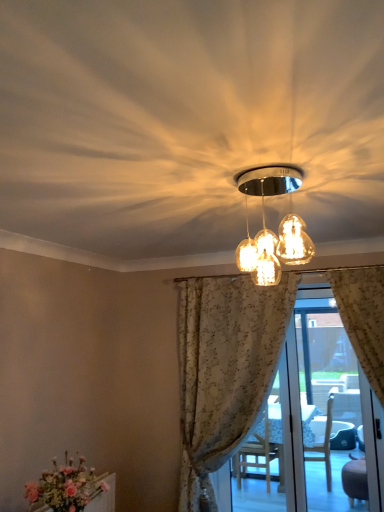
The image size is (384, 512). In order to click on floral fabric curtain at center in this screenshot , I will do `click(225, 369)`.

Find the location of `matte pink flowers at lower left`. matte pink flowers at lower left is located at coordinates (65, 487).

Is matte glass light fixture at center at the back of matte pink flowers at lower left?

No, matte pink flowers at lower left's orientation is not away from matte glass light fixture at center.

Who is bigger, matte pink flowers at lower left or matte glass light fixture at center?

Bigger between the two is matte pink flowers at lower left.

Considering the positions of point (85, 497) and point (270, 170), is point (85, 497) closer or farther from the camera than point (270, 170)?

Point (85, 497).

Which of these two, matte pink flowers at lower left or matte glass light fixture at center, is thinner?

matte pink flowers at lower left is thinner.

From a real-world perspective, does translucent floral curtains at center sit lower than matte glass light fixture at center?

Yes, from a real-world perspective, translucent floral curtains at center is below matte glass light fixture at center.

Identify the location of lamp above the translucent floral curtains at center (from the image's perspective). The height and width of the screenshot is (512, 384). (284, 251).

Does translucent floral curtains at center appear on the left side of matte glass light fixture at center?

In fact, translucent floral curtains at center is to the right of matte glass light fixture at center.

Is translucent floral curtains at center placed right next to matte glass light fixture at center?

No, translucent floral curtains at center is not in contact with matte glass light fixture at center.

From a real-world perspective, is matte glass light fixture at center physically located above or below matte pink flowers at lower left?

From a real-world perspective, matte glass light fixture at center is physically above matte pink flowers at lower left.

Is matte glass light fixture at center behind matte pink flowers at lower left?

No, matte glass light fixture at center is closer to the camera.

In the scene shown: Considering the sizes of matte glass light fixture at center and matte pink flowers at lower left in the image, is matte glass light fixture at center bigger or smaller than matte pink flowers at lower left?

Considering their sizes, matte glass light fixture at center takes up less space than matte pink flowers at lower left.

Is matte pink flowers at lower left surrounding floral fabric curtain at center?

No, floral fabric curtain at center is not a part of matte pink flowers at lower left.

Which of these two, matte pink flowers at lower left or floral fabric curtain at center, is wider?

floral fabric curtain at center is wider.

Could you tell me if matte glass light fixture at center is turned towards translucent floral curtains at center?

No, matte glass light fixture at center does not turn towards translucent floral curtains at center.

Does matte glass light fixture at center have a lesser width compared to translucent floral curtains at center?

No.

From a real-world perspective, is matte glass light fixture at center physically located above or below translucent floral curtains at center?

From a real-world perspective, matte glass light fixture at center is physically above translucent floral curtains at center.

Is matte glass light fixture at center at the right side of translucent floral curtains at center?

Incorrect, matte glass light fixture at center is not on the right side of translucent floral curtains at center.

Does floral fabric curtain at center have a smaller size compared to matte glass light fixture at center?

No.

In terms of width, does floral fabric curtain at center look wider or thinner when compared to matte glass light fixture at center?

In the image, floral fabric curtain at center appears to be wider than matte glass light fixture at center.

Considering the relative positions of floral fabric curtain at center and matte glass light fixture at center in the image provided, is floral fabric curtain at center to the right of matte glass light fixture at center from the viewer's perspective?

Yes.

Identify the location of curtain below the matte glass light fixture at center (from a real-world perspective). The image size is (384, 512). (225, 369).

From the image's perspective, is matte glass light fixture at center above or below floral fabric curtain at center?

From the image's perspective, matte glass light fixture at center appears above floral fabric curtain at center.

Is point (281, 222) behind point (220, 414)?

No.

Is matte glass light fixture at center not near floral fabric curtain at center?

Yes.

Where is `lamp in front of the matte pink flowers at lower left`? This screenshot has height=512, width=384. lamp in front of the matte pink flowers at lower left is located at coordinates (284, 251).

Identify the location of lamp above the translucent floral curtains at center (from the image's perspective). Image resolution: width=384 pixels, height=512 pixels. (284, 251).

Based on their spatial positions, is matte pink flowers at lower left or translucent floral curtains at center further from matte glass light fixture at center?

Among the two, translucent floral curtains at center is located further to matte glass light fixture at center.

Looking at the image, which one is located further to matte glass light fixture at center, translucent floral curtains at center or floral fabric curtain at center?

translucent floral curtains at center.

Looking at the image, which one is located further to matte pink flowers at lower left, matte glass light fixture at center or translucent floral curtains at center?

The object further to matte pink flowers at lower left is translucent floral curtains at center.

Estimate the real-world distances between objects in this image. Which object is closer to translucent floral curtains at center, matte pink flowers at lower left or matte glass light fixture at center?

matte pink flowers at lower left.

Considering their positions, is translucent floral curtains at center positioned further to matte pink flowers at lower left than floral fabric curtain at center?

translucent floral curtains at center lies further to matte pink flowers at lower left than the other object.

From the image, which object appears to be nearer to translucent floral curtains at center, floral fabric curtain at center or matte pink flowers at lower left?

Based on the image, floral fabric curtain at center appears to be nearer to translucent floral curtains at center.

From the image, which object appears to be nearer to floral fabric curtain at center, translucent floral curtains at center or matte pink flowers at lower left?

Among the two, translucent floral curtains at center is located nearer to floral fabric curtain at center.

From the image, which object appears to be farther from matte glass light fixture at center, floral fabric curtain at center or translucent floral curtains at center?

translucent floral curtains at center is positioned further to the anchor matte glass light fixture at center.

Image resolution: width=384 pixels, height=512 pixels. Identify the location of curtain between matte pink flowers at lower left and translucent floral curtains at center from left to right. (225, 369).

Find the location of a particular element. The image size is (384, 512). curtain between matte glass light fixture at center and translucent floral curtains at center in the front-back direction is located at coordinates (225, 369).

Find the location of a particular element. Image resolution: width=384 pixels, height=512 pixels. screen door between matte glass light fixture at center and matte pink flowers at lower left vertically is located at coordinates pyautogui.click(x=309, y=403).

The width and height of the screenshot is (384, 512). Identify the location of curtain between matte glass light fixture at center and matte pink flowers at lower left in the vertical direction. (225, 369).